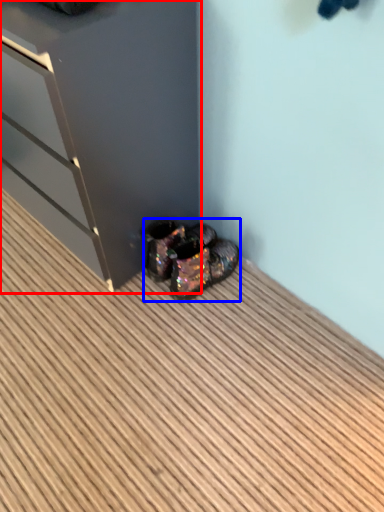
Question: Which object appears farthest to the camera in this image, dresser (highlighted by a red box) or footwear (highlighted by a blue box)?

Choices:
 (A) dresser
 (B) footwear

Answer: (B)